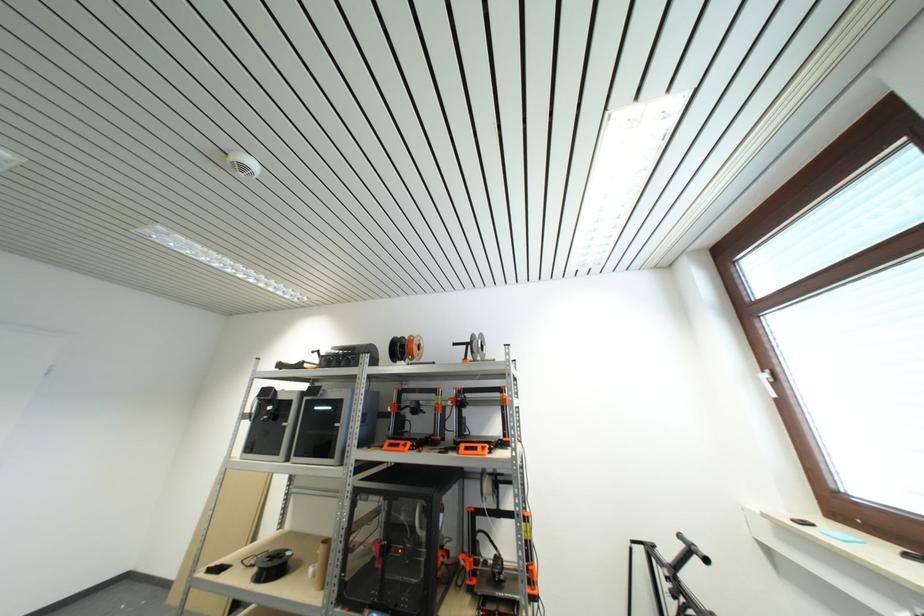
Find where to grasp the black handlebar. Please return your answer as a coordinate pair (x, y).

(669, 577)